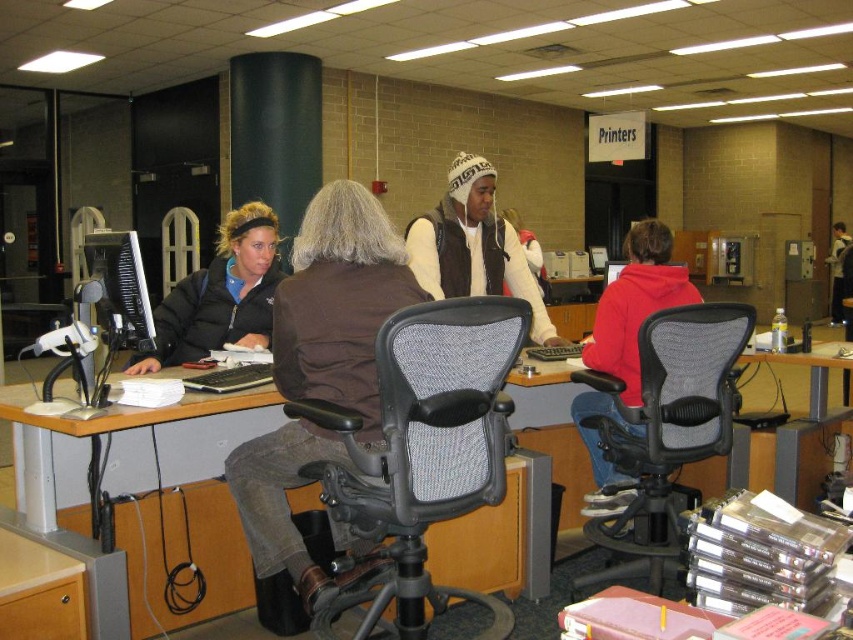
Image resolution: width=853 pixels, height=640 pixels. Describe the element at coordinates (201, 509) in the screenshot. I see `wooden desk at center` at that location.

Is wooden desk at center positioned behind black mesh swivel chair at center?

No, wooden desk at center is in front of black mesh swivel chair at center.

Describe the element at coordinates (201, 509) in the screenshot. I see `wooden desk at center` at that location.

Where is `wooden desk at center`? The image size is (853, 640). wooden desk at center is located at coordinates (201, 509).

Can you confirm if wooden desk at center is taller than matte gray desk at center?

Incorrect, wooden desk at center's height is not larger of matte gray desk at center's.

Is wooden desk at center shorter than matte gray desk at center?

Yes, wooden desk at center is shorter than matte gray desk at center.

Where is `wooden desk at center`? The height and width of the screenshot is (640, 853). wooden desk at center is located at coordinates (201, 509).

Who is positioned more to the left, black mesh swivel chair at center or red fleece hoodie at center?

black mesh swivel chair at center

How distant is black mesh swivel chair at center from red fleece hoodie at center?

A distance of 7.58 inches exists between black mesh swivel chair at center and red fleece hoodie at center.

You are a GUI agent. You are given a task and a screenshot of the screen. Output one action in this format:
    pyautogui.click(x=<x>, y=<y>)
    Task: Click on the black mesh swivel chair at center
    
    Given the screenshot: What is the action you would take?
    pyautogui.click(x=668, y=433)